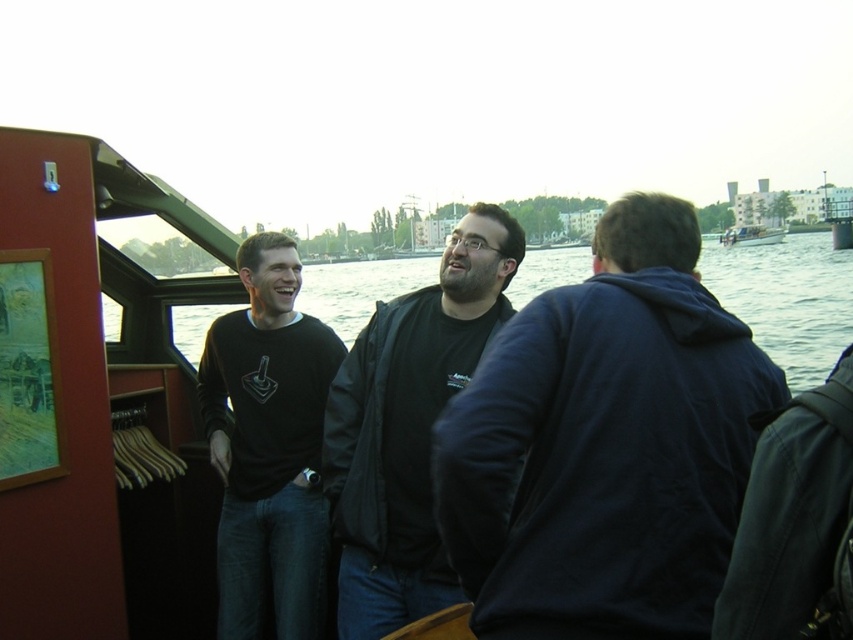
You are a photographer trying to capture a group photo of the three men in the boat cabin. Since the black matte shirt at center and the white plastic boat at upper right are both in the frame, which object should you prioritize focusing on to ensure it is clearly visible in the photo?

The white plastic boat at upper right should be prioritized for focus because it occupies more space in the frame than the black matte shirt at center.

You are a photographer trying to capture a photo of the black matte shirt at center and the white plastic boat at upper right. Which object should you focus on first if you want to ensure both are in sharp focus, considering their sizes in the frame?

The black matte shirt at center is not as tall as the white plastic boat at upper right, so you should focus on the taller white plastic boat at upper right first to ensure both are in sharp focus.